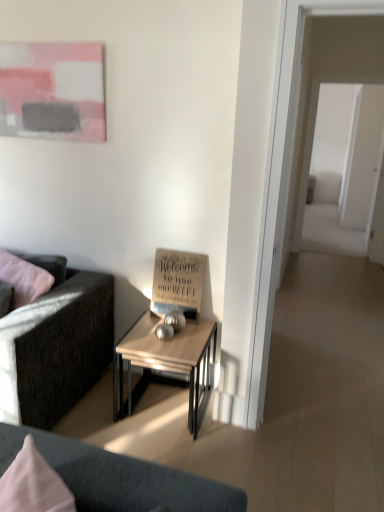
You are a GUI agent. You are given a task and a screenshot of the screen. Output one action in this format:
    pyautogui.click(x=<x>, y=<y>)
    Task: Click on the free space in front of wooden table at center
    
    Given the screenshot: What is the action you would take?
    coord(175,449)